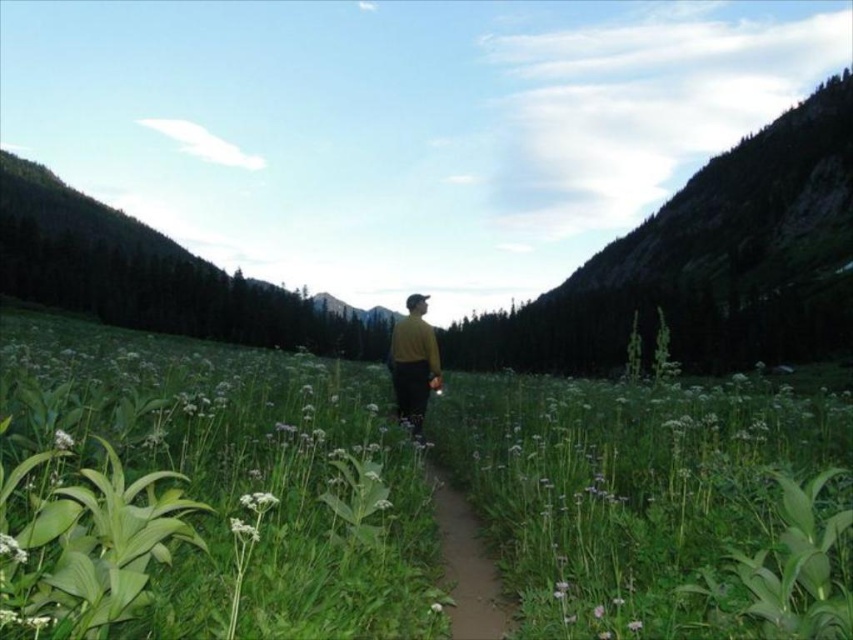
You are standing at the center of the dirt path in the mountain valley and see both the matte yellow sweater at center and the white fluffy flower at center. Which object is closer to you?

Both the matte yellow sweater at center and the white fluffy flower at center are at the same distance from you since they are both located at the center of the dirt path.

You are a hiker walking along the narrow dirt path in the mountain valley. You spot a white fuzzy flower at lower center and a pink matte flower at center. Which flower is closer to your current position?

The white fuzzy flower at lower center is closer to your current position because it is in front of the pink matte flower at center.